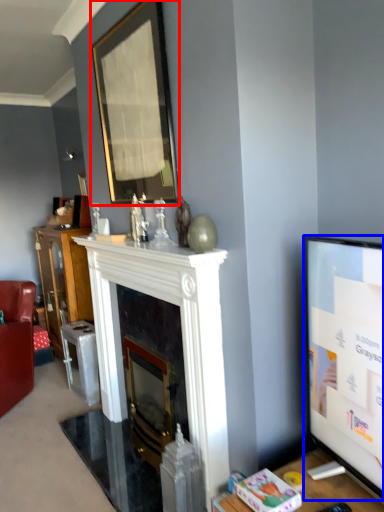
Question: Which of the following is the farthest to the observer, picture frame (highlighted by a red box) or television (highlighted by a blue box)?

Choices:
 (A) picture frame
 (B) television

Answer: (A)